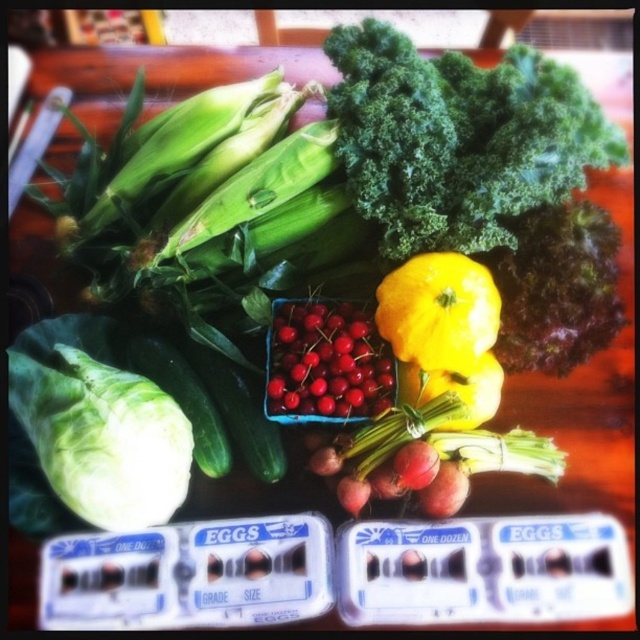
What is located at the point with coordinates (458, 138) in the image?

The point at coordinates (458, 138) indicates the location of the green leafy at upper center.

You are arranging vegetables on a table and have the green leafy at upper center and the yellow matte squash at center. Which vegetable is more to the right?

The green leafy at upper center is more to the right because it is positioned on the right side of the yellow matte squash at center.

You are standing at the origin point of the image. Which of the two points, point [428,186] or point [156,451], is located further away from you?

Point [428,186] is behind point [156,451], so it is further away from you.